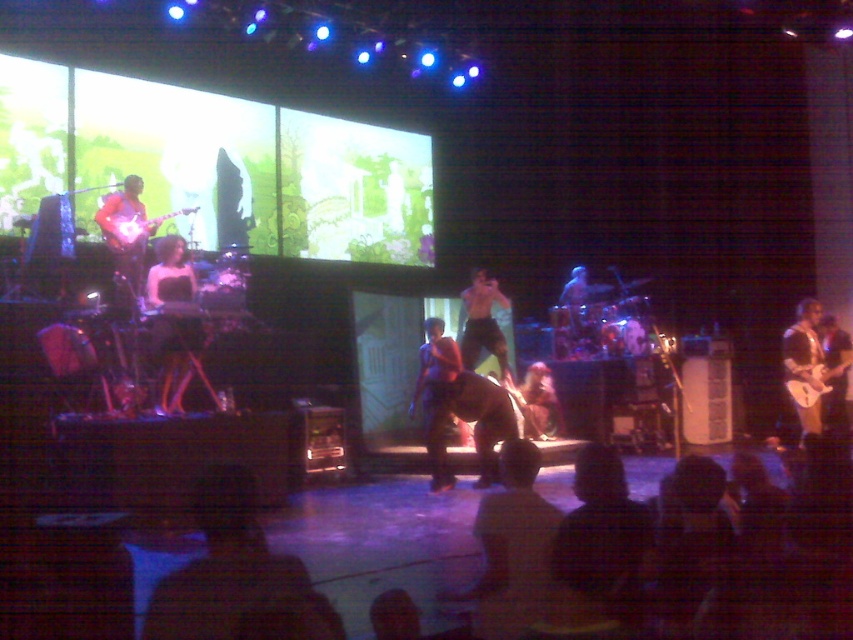
You are a stagehand preparing to place a spotlight on the stage. You have two points marked for potential placement. The first point is at coordinates point (453, 358) and the second is at point (805, 381). Based on their positions, which point is closer to the audience? Please answer based on the provided scene description.

Point (453, 358) is in front of point (805, 381), so it is closer to the audience.

You are a photographer in the audience trying to capture a clear photo of the dark purple shirt at center and the glossy brown guitar at right. Which object should you focus on first to ensure both are in focus?

The dark purple shirt at center is in front of the glossy brown guitar at right, so you should focus on the dark purple shirt at center first to ensure both are in focus.

You are a photographer in the audience at a concert. You want to take a photo of the performer in the matte black dress at center without any obstructions. The stage is lit with blue lights. There is a point at coordinates point (173, 317) on the dress. Is there any part of the dress that might be in front of the performer making it hard to see them clearly?

The point (173, 317) is on the matte black dress at center, so there is no obstruction from the dress itself as it is part of the performer. However, other elements like the drummer near the electric guitar on the left or the large screens in the background might obstruct the view depending on your angle.